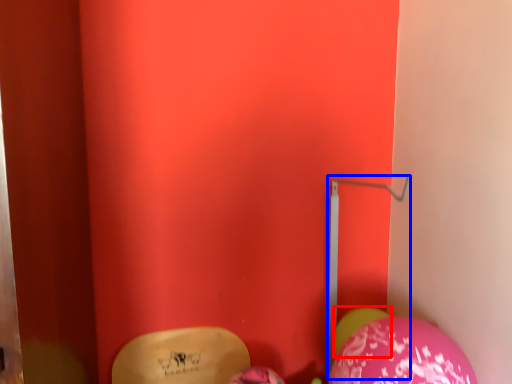
Question: Which of the following is the farthest to the observer, balloon (highlighted by a red box) or trim (highlighted by a blue box)?

Choices:
 (A) balloon
 (B) trim

Answer: (A)